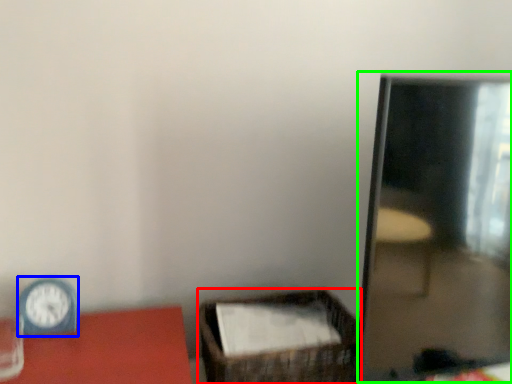
Question: Based on their relative distances, which object is nearer to basket (highlighted by a red box)? Choose from clock (highlighted by a blue box) and mirror (highlighted by a green box).

Choices:
 (A) clock
 (B) mirror

Answer: (B)